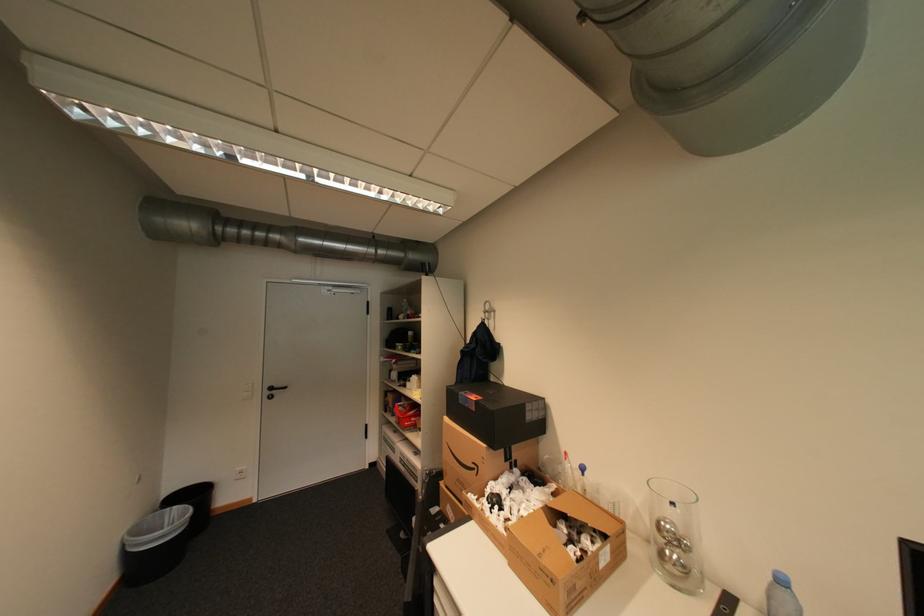
The location [678,560] corresponds to which object?

It corresponds to the shiny metal sphere in the image.